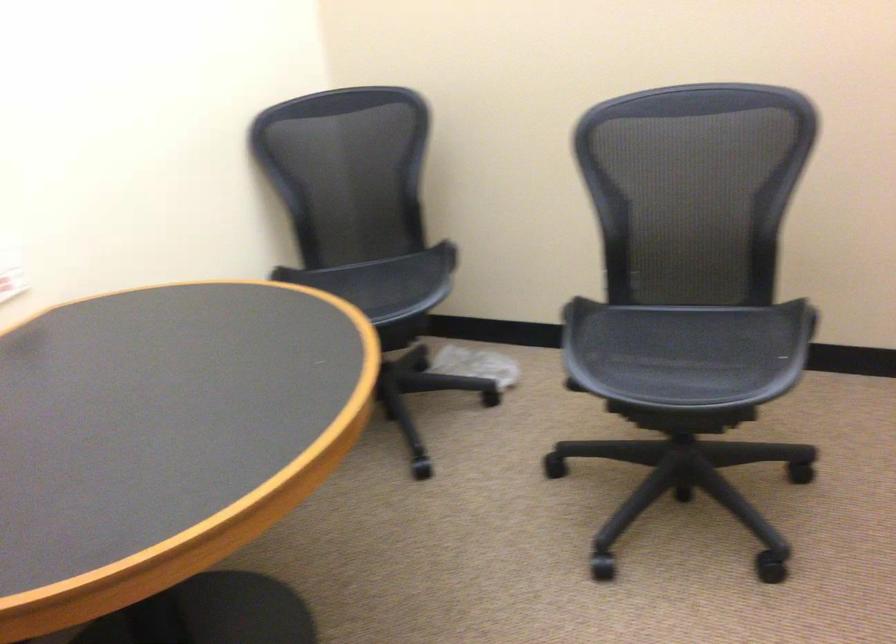
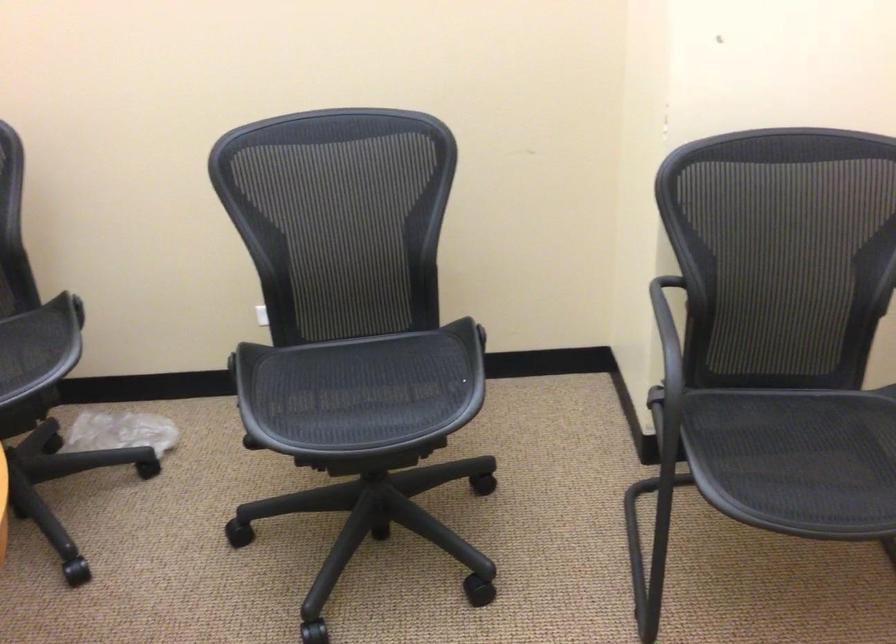
Question: The camera is either moving clockwise (left) or counter-clockwise (right) around the object. The first image is from the beginning of the video and the second image is from the end. Is the camera moving left or right when shooting the video?

Choices:
 (A) Left
 (B) Right

Answer: (A)